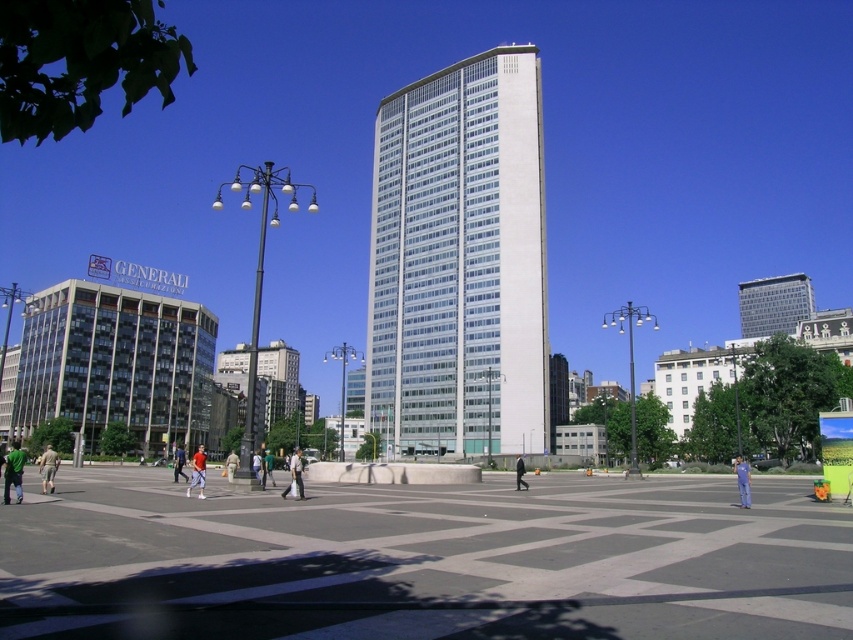
Is clear glass skyscraper at upper right smaller than dark blue suit at center?

No.

Can you confirm if clear glass skyscraper at upper right is taller than dark blue suit at center?

Correct, clear glass skyscraper at upper right is much taller as dark blue suit at center.

The height and width of the screenshot is (640, 853). What do you see at coordinates (775, 305) in the screenshot? I see `clear glass skyscraper at upper right` at bounding box center [775, 305].

Locate an element on the screen. The width and height of the screenshot is (853, 640). clear glass skyscraper at upper right is located at coordinates (775, 305).

Which is more to the right, white glass building at center or light blue jeans at center?

Positioned to the right is white glass building at center.

Is point (532, 116) closer to camera compared to point (178, 465)?

No, it is not.

Who is more forward, (396, 131) or (180, 444)?

Point (180, 444)

This screenshot has width=853, height=640. Identify the location of white glass building at center. point(459,260).

Which of these two, white glass building at center or green fabric pants at center, stands shorter?

green fabric pants at center is shorter.

Does white glass building at center have a larger size compared to green fabric pants at center?

Yes, white glass building at center is bigger than green fabric pants at center.

Image resolution: width=853 pixels, height=640 pixels. Describe the element at coordinates (459, 260) in the screenshot. I see `white glass building at center` at that location.

Locate an element on the screen. white glass building at center is located at coordinates (459, 260).